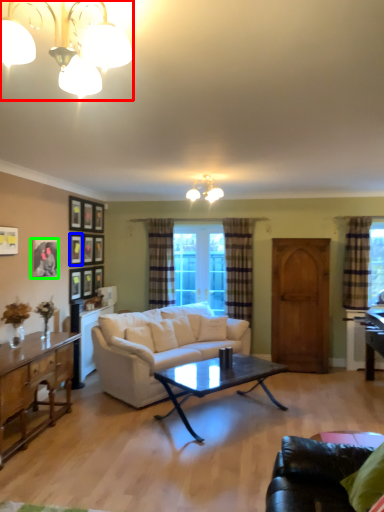
Question: Which is nearer to the lamp (highlighted by a red box)? picture frame (highlighted by a blue box) or picture frame (highlighted by a green box).

Choices:
 (A) picture frame
 (B) picture frame

Answer: (B)